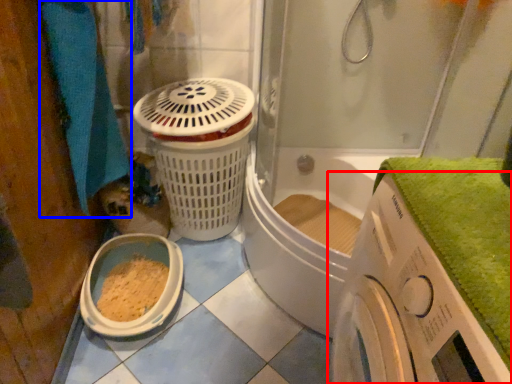
Question: Among these objects, which one is nearest to the camera, washing machine (highlighted by a red box) or bath towel (highlighted by a blue box)?

Choices:
 (A) washing machine
 (B) bath towel

Answer: (A)